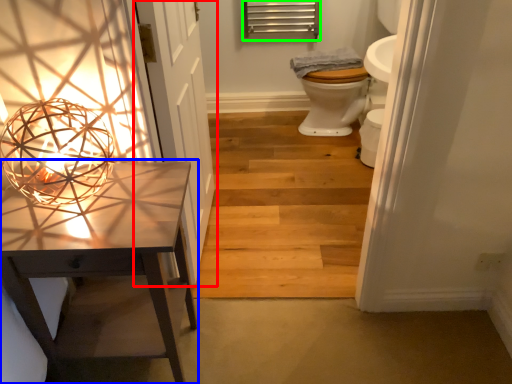
Question: Which object is positioned closest to door (highlighted by a red box)? Select from table (highlighted by a blue box) and shutter (highlighted by a green box).

Choices:
 (A) table
 (B) shutter

Answer: (A)